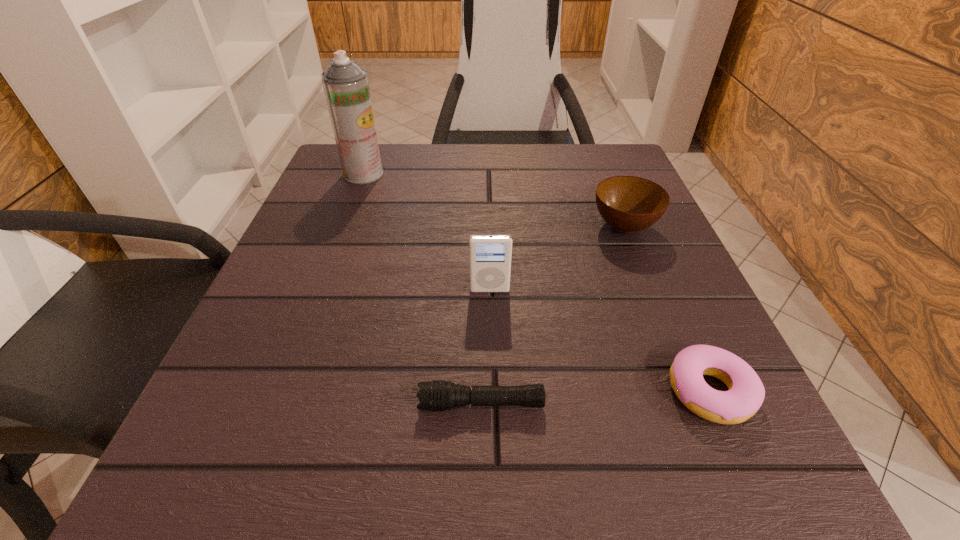
In order to click on free region located 0.150m on the back of the bowl in this screenshot , I will do `click(601, 170)`.

Locate an element on the screen. Image resolution: width=960 pixels, height=540 pixels. free space located 0.390m on the left of the doughnut is located at coordinates (367, 391).

At what (x,y) coordinates should I click in order to perform the action: click on vacant space situated at the lens end of the flashlight. Please return your answer as a coordinate pair (x, y). This screenshot has height=540, width=960. Looking at the image, I should click on (364, 404).

Image resolution: width=960 pixels, height=540 pixels. In order to click on blank space located 0.080m at the lens end of the flashlight in this screenshot , I will do `click(356, 404)`.

Where is `blank space located 0.090m at the lens end of the flashlight`? This screenshot has width=960, height=540. blank space located 0.090m at the lens end of the flashlight is located at coordinates (348, 404).

Identify the location of object at the far edge. (346, 87).

The height and width of the screenshot is (540, 960). Find the location of `object that is positioned at the left edge`. object that is positioned at the left edge is located at coordinates (346, 87).

You are a GUI agent. You are given a task and a screenshot of the screen. Output one action in this format:
    pyautogui.click(x=<x>, y=<y>)
    Task: Click on the bowl present at the right edge
    
    Given the screenshot: What is the action you would take?
    pyautogui.click(x=628, y=204)

At what (x,y) coordinates should I click in order to perform the action: click on doughnut located in the right edge section of the desktop. Please return your answer as a coordinate pair (x, y). Looking at the image, I should click on (745, 395).

Where is `object that is at the far left corner`? object that is at the far left corner is located at coordinates (346, 87).